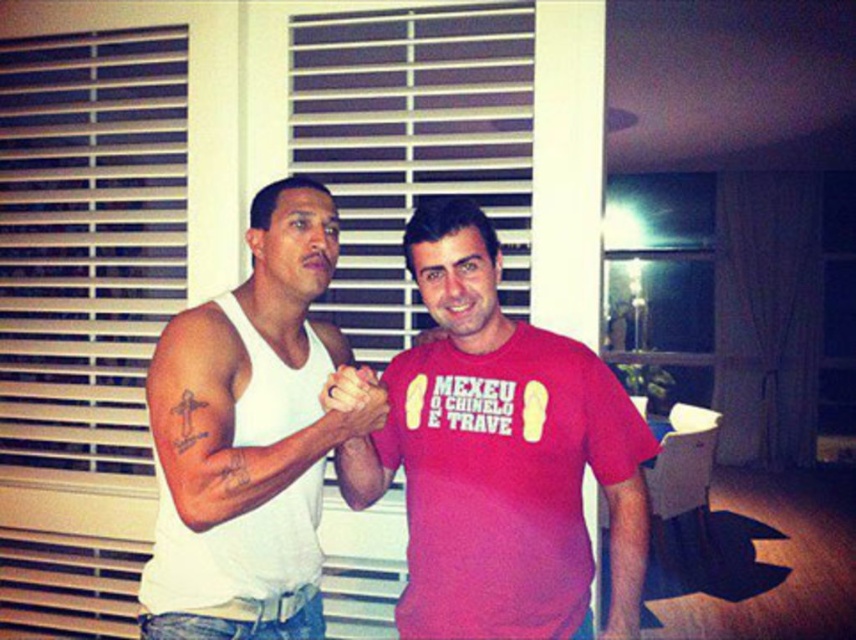
Question: Is matte red t-shirt at center above white smooth muscle at upper left?

Choices:
 (A) no
 (B) yes

Answer: (A)

Question: Can you confirm if white matte tank top at center is positioned above matte pink t-shirt at center?

Choices:
 (A) no
 (B) yes

Answer: (B)

Question: Which point is closer to the camera?

Choices:
 (A) (642, 429)
 (B) (449, 547)

Answer: (B)

Question: Which object is positioned closest to the white smooth muscle at upper left?

Choices:
 (A) matte pink shirt at center
 (B) white matte arm at center
 (C) matte red t-shirt at center

Answer: (B)

Question: Is matte red t-shirt at center closer to the viewer compared to white smooth muscle at upper left?

Choices:
 (A) yes
 (B) no

Answer: (B)

Question: Which is nearer to the white smooth muscle at upper left?

Choices:
 (A) white matte arm at center
 (B) matte red t-shirt at center
 (C) white matte tank top at center

Answer: (C)